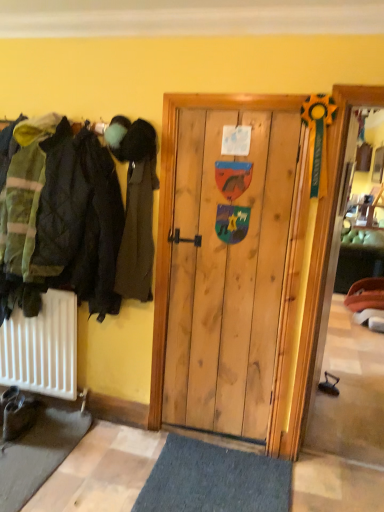
Question: Should I look upward or downward to see brown leather boot at lower left?

Choices:
 (A) up
 (B) down

Answer: (B)

Question: Can you confirm if dark green fabric coat at left is bigger than brown leather boot at lower left?

Choices:
 (A) no
 (B) yes

Answer: (B)

Question: Is dark green fabric coat at left smaller than brown leather boot at lower left?

Choices:
 (A) no
 (B) yes

Answer: (A)

Question: Can you confirm if dark green fabric coat at left is positioned to the left of brown leather boot at lower left?

Choices:
 (A) no
 (B) yes

Answer: (A)

Question: Is dark green fabric coat at left not inside brown leather boot at lower left?

Choices:
 (A) yes
 (B) no

Answer: (A)

Question: Is dark green fabric coat at left facing towards brown leather boot at lower left?

Choices:
 (A) yes
 (B) no

Answer: (B)

Question: From a real-world perspective, is dark green fabric coat at left located beneath brown leather boot at lower left?

Choices:
 (A) yes
 (B) no

Answer: (B)

Question: From the image's perspective, is brown leather boot at lower left beneath dark green fabric coat at left?

Choices:
 (A) no
 (B) yes

Answer: (B)

Question: Is brown leather boot at lower left aimed at dark green fabric coat at left?

Choices:
 (A) yes
 (B) no

Answer: (B)

Question: Is brown leather boot at lower left at the right side of dark green fabric coat at left?

Choices:
 (A) yes
 (B) no

Answer: (B)

Question: Is brown leather boot at lower left further to the viewer compared to dark green fabric coat at left?

Choices:
 (A) yes
 (B) no

Answer: (A)

Question: Is brown leather boot at lower left taller than dark green fabric coat at left?

Choices:
 (A) no
 (B) yes

Answer: (A)

Question: Considering the relative sizes of brown leather boot at lower left and dark green fabric coat at left in the image provided, is brown leather boot at lower left wider than dark green fabric coat at left?

Choices:
 (A) no
 (B) yes

Answer: (B)

Question: Do you think dark green fabric coat at left is within brown leather boot at lower left, or outside of it?

Choices:
 (A) inside
 (B) outside

Answer: (B)